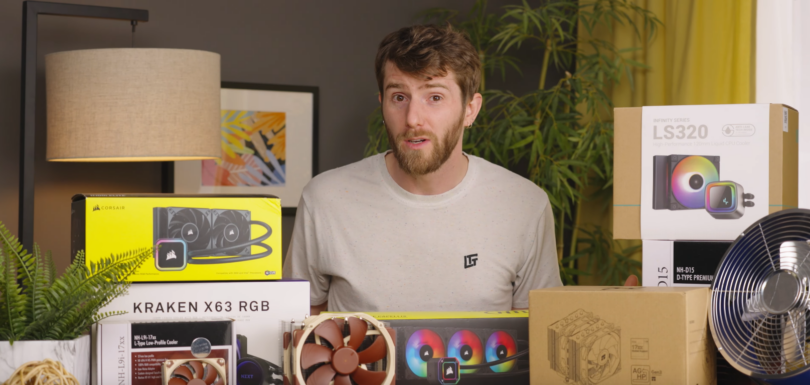
Image resolution: width=810 pixels, height=385 pixels. I want to click on yellow box of a speaker, so click(228, 264).